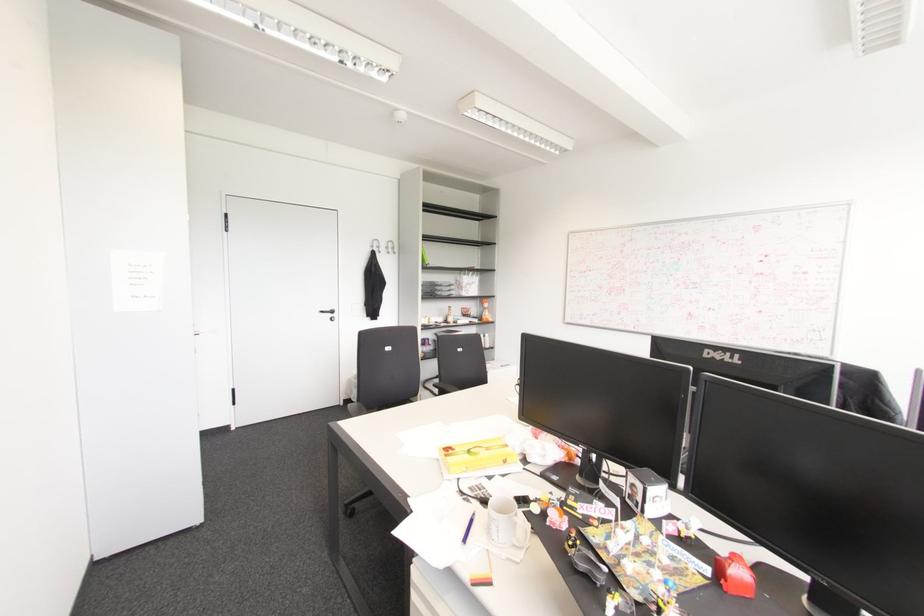
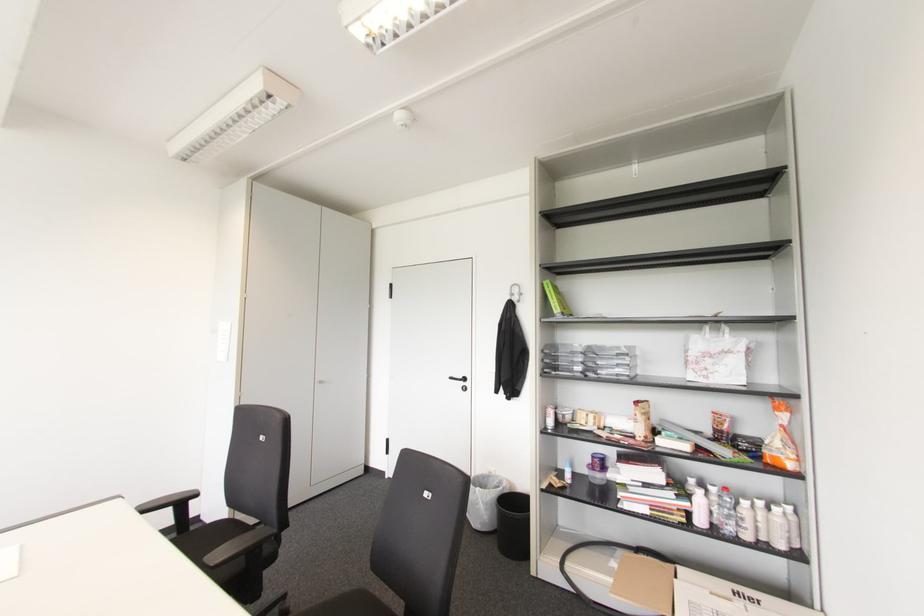
The point at [332,310] is marked in the first image. Where is the corresponding point in the second image?

(464, 379)